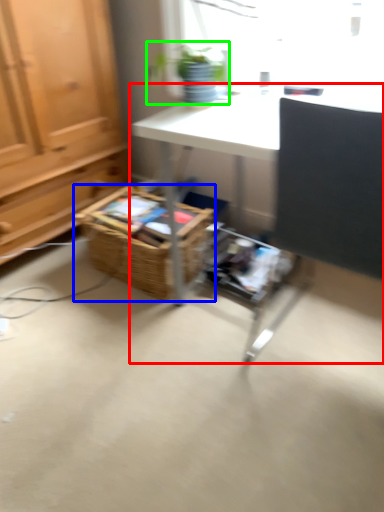
Question: Which object is positioned farthest from desk (highlighted by a red box)? Select from basket (highlighted by a blue box) and houseplant (highlighted by a green box).

Choices:
 (A) basket
 (B) houseplant

Answer: (A)